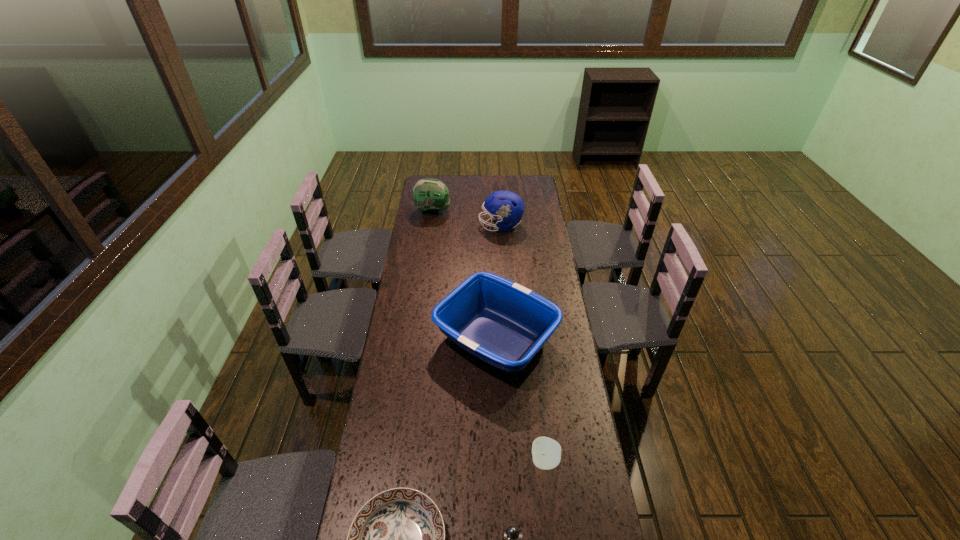
At what (x,y) coordinates should I click in order to perform the action: click on the right football helmet. Please return your answer as a coordinate pair (x, y). Looking at the image, I should click on click(507, 207).

In order to click on the left football helmet in this screenshot , I will do `click(430, 195)`.

In order to click on the third farthest object in this screenshot , I will do `click(502, 323)`.

Locate an element on the screen. This screenshot has width=960, height=540. tray is located at coordinates (502, 323).

This screenshot has width=960, height=540. Find the location of `apple`. apple is located at coordinates (546, 452).

The width and height of the screenshot is (960, 540). Identify the location of blank space located 0.320m on the face guard of the right football helmet. (420, 226).

Where is `vacant space located on the face guard of the right football helmet`? Image resolution: width=960 pixels, height=540 pixels. vacant space located on the face guard of the right football helmet is located at coordinates (468, 226).

This screenshot has width=960, height=540. Find the location of `vacant area situated on the face guard of the right football helmet`. vacant area situated on the face guard of the right football helmet is located at coordinates (436, 226).

This screenshot has height=540, width=960. I want to click on blank area located 0.370m on the visor of the left football helmet, so click(516, 211).

Where is `free spot located 0.120m on the back of the fourth shortest object`? The image size is (960, 540). free spot located 0.120m on the back of the fourth shortest object is located at coordinates (494, 278).